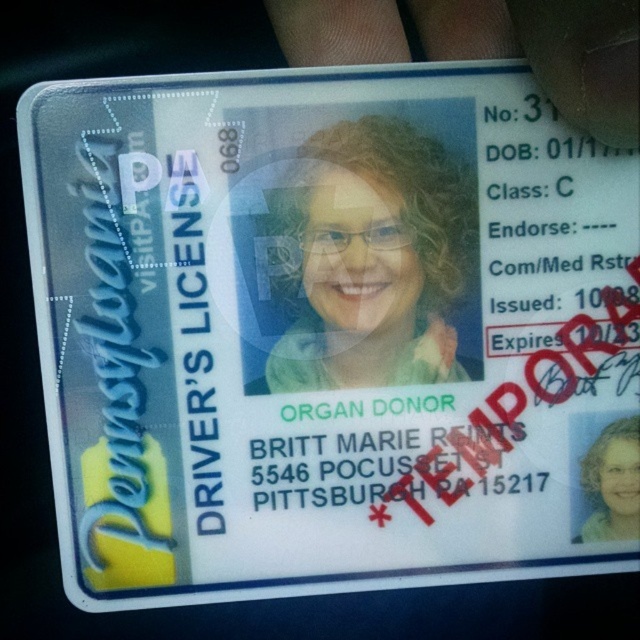
You are designing a new Pennsylvania driver license and want to ensure that the matte plastic photo at center and the transparent plastic hand at upper center are positioned correctly. Based on the current design, which object has a smaller width?

The matte plastic photo at center has a lesser width compared to the transparent plastic hand at upper center.

You are a security officer checking the authenticity of a Pennsylvania driver license. You notice a transparent plastic hand at the specified coordinate. What is located at point (x=550, y=52) on the license?

The transparent plastic hand at upper center is located at point (x=550, y=52).

You are a graphic designer working on a Pennsylvania driver license template. You need to ensure that the transparent plastic hand at upper center and the light brown hair at center are at least 12 inches apart to avoid overlapping. Based on the provided image, is this requirement met?

The transparent plastic hand at upper center and the light brown hair at center are 12.03 inches apart from each other, which meets the requirement of being at least 12 inches apart to avoid overlapping.